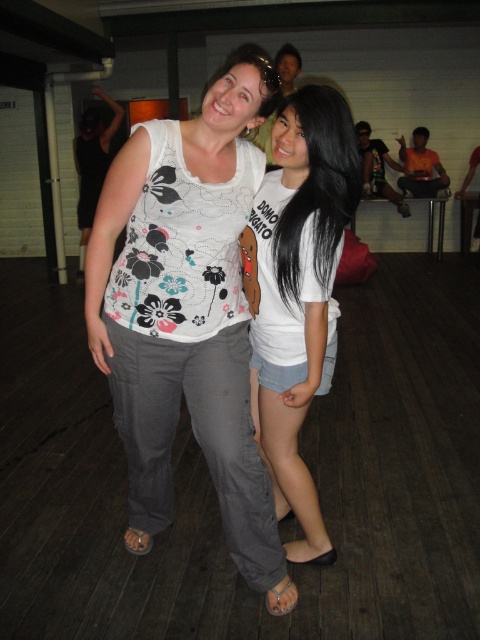
Question: Which object is closer to the camera taking this photo?

Choices:
 (A) white cotton t-shirt at center
 (B) white printed tank top at center

Answer: (B)

Question: Does white printed tank top at center have a lesser width compared to white cotton t-shirt at center?

Choices:
 (A) no
 (B) yes

Answer: (A)

Question: Which point appears farthest from the camera in this image?

Choices:
 (A) (187, 180)
 (B) (305, 236)

Answer: (B)

Question: Is white printed tank top at center below white cotton t-shirt at center?

Choices:
 (A) yes
 (B) no

Answer: (B)

Question: Is white printed tank top at center to the left of white cotton t-shirt at center from the viewer's perspective?

Choices:
 (A) no
 (B) yes

Answer: (B)